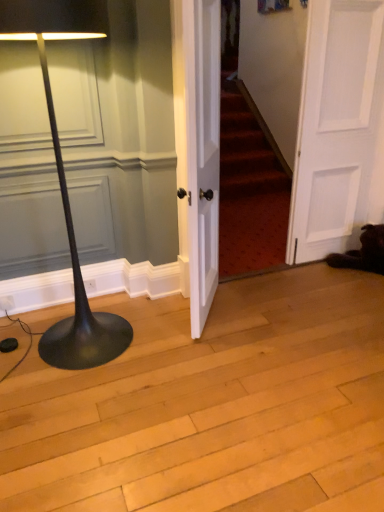
Where is `vacant space in front of white matte door at right, which is counted as the 2th door, starting from the left`? vacant space in front of white matte door at right, which is counted as the 2th door, starting from the left is located at coordinates (333, 287).